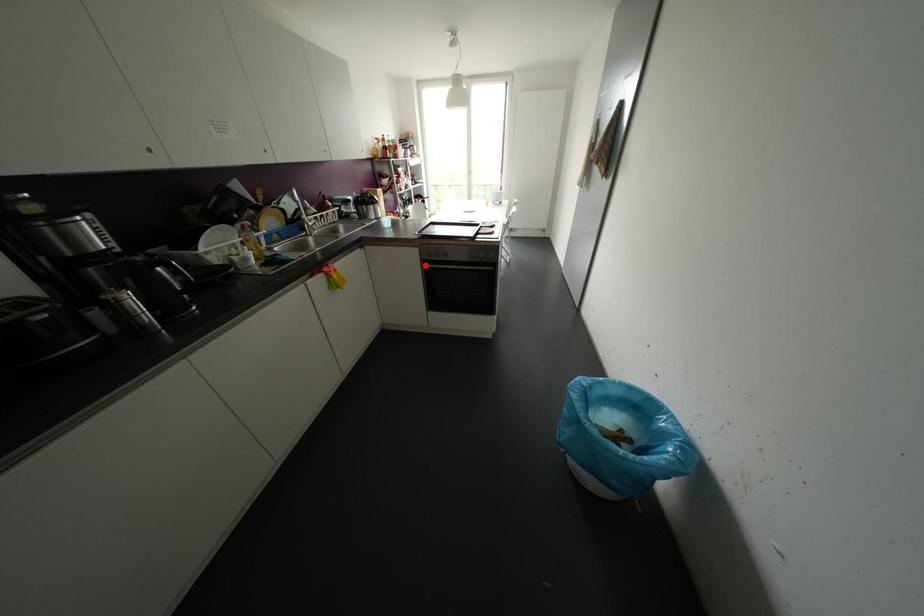
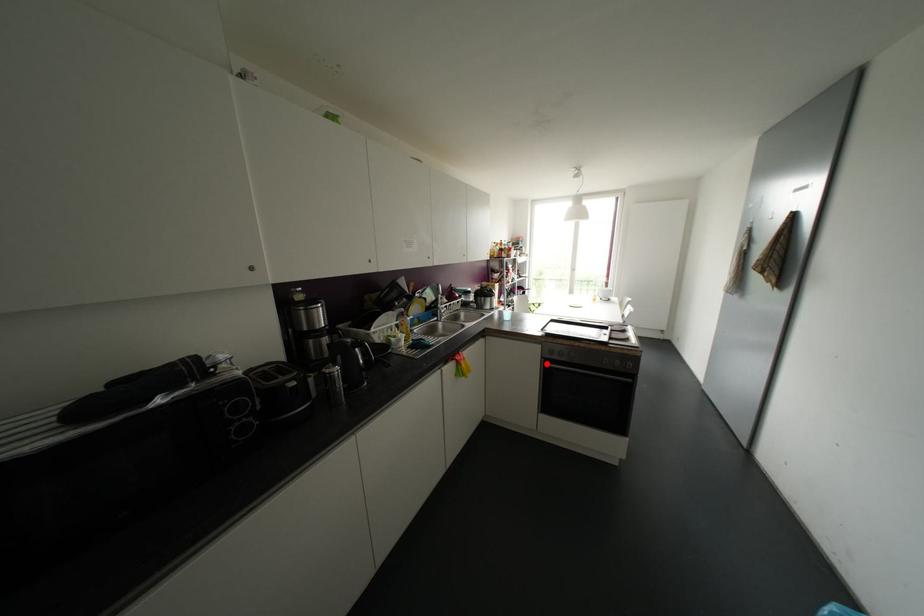
I am providing you with two images of the same scene from different viewpoints. A red point is marked on the first image and another point is marked on the second image. Are the points marked in image1 and image2 representing the same 3D position?

Yes